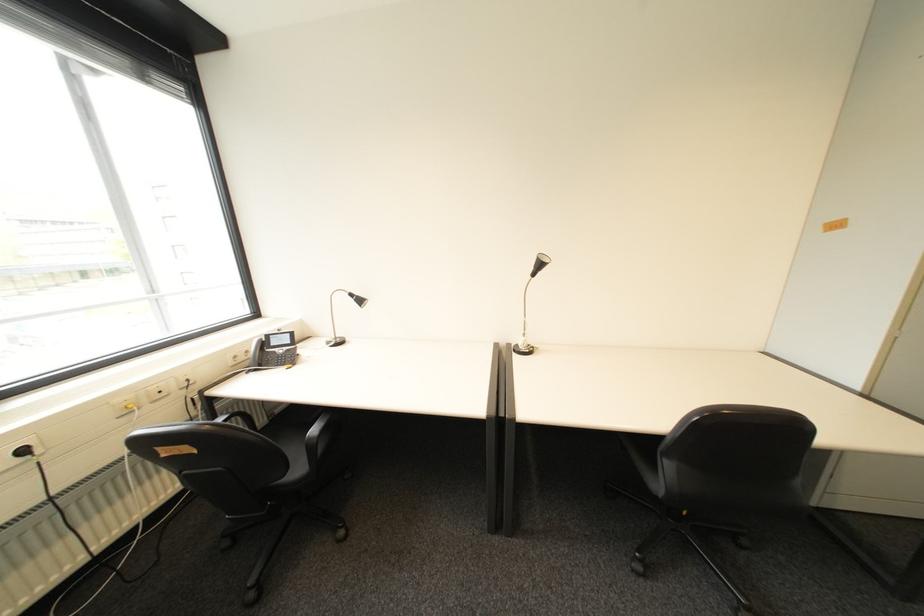
You are a GUI agent. You are given a task and a screenshot of the screen. Output one action in this format:
    pyautogui.click(x=<x>, y=<y>)
    Task: Click on the phone handset
    The width and height of the screenshot is (924, 616).
    Given the screenshot: What is the action you would take?
    pyautogui.click(x=253, y=354)